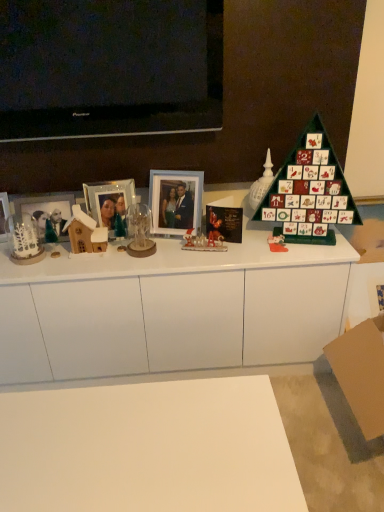
What are the coordinates of `free location to the right of white frosted glass jar at left, which is counted as the first toy, starting from the left` in the screenshot? It's located at (67, 264).